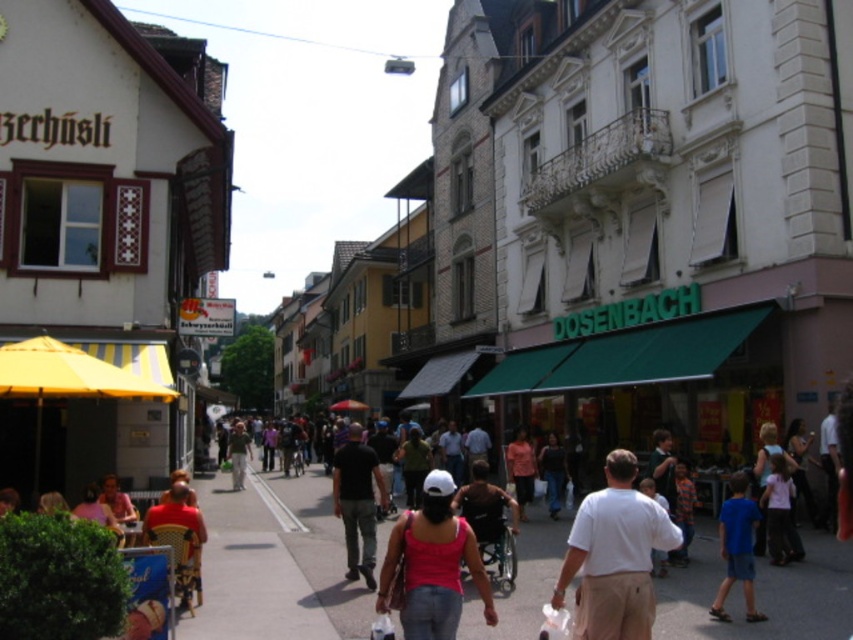
Question: Is smooth asphalt sidewalk at center positioned at the back of black cotton shirt at center?

Choices:
 (A) no
 (B) yes

Answer: (A)

Question: Is smooth asphalt sidewalk at center thinner than white cotton shirt at center?

Choices:
 (A) no
 (B) yes

Answer: (A)

Question: Which object is farther from the camera taking this photo?

Choices:
 (A) blue cotton shirt at lower right
 (B) white cotton shirt at center

Answer: (A)

Question: Which of these objects is positioned closest to the green fabric awning at center?

Choices:
 (A) black cotton shirt at center
 (B) white cotton shirt at center

Answer: (B)

Question: Does black cotton shirt at center have a lesser width compared to blue cotton shirt at lower right?

Choices:
 (A) no
 (B) yes

Answer: (B)

Question: Considering the real-world distances, which object is closest to the white cotton shirt at center?

Choices:
 (A) pink fabric tank top at center
 (B) black cotton shirt at center

Answer: (A)